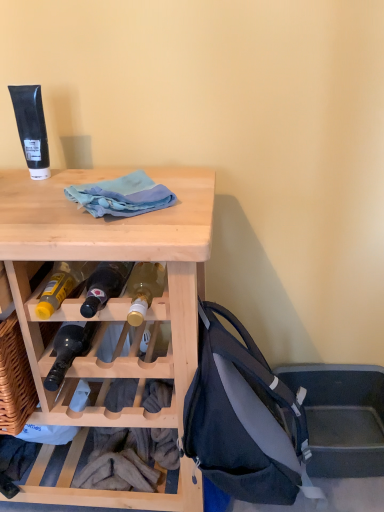
This screenshot has width=384, height=512. In order to click on vacant space to the left of light blue fabric at center in this screenshot , I will do `click(38, 204)`.